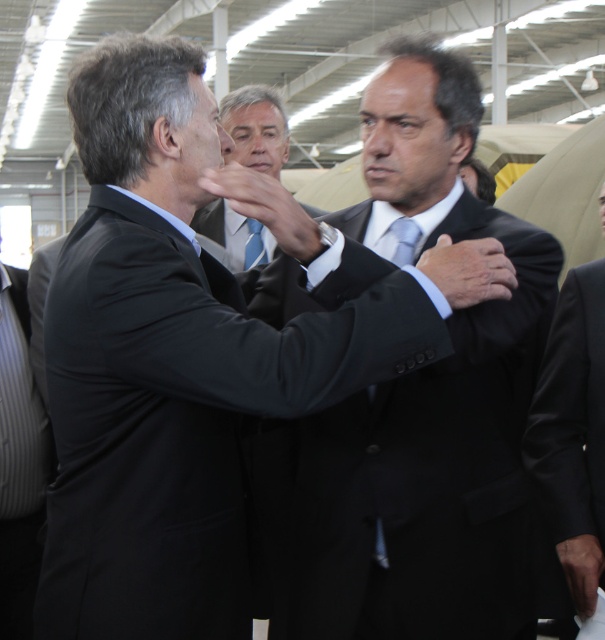
Is point (580, 276) less distant than point (280, 164)?

Yes, point (580, 276) is closer to viewer.

Image resolution: width=605 pixels, height=640 pixels. In order to click on black satin suit at right in this screenshot , I will do `click(572, 433)`.

Who is more forward, (586, 458) or (234, 92)?

Point (586, 458)

Identify the location of black satin suit at right. The image size is (605, 640). (572, 433).

Between gray striped suit at left and matte black suit at center, which one appears on the right side from the viewer's perspective?

matte black suit at center

The width and height of the screenshot is (605, 640). What are the coordinates of `gray striped suit at left` in the screenshot? It's located at pyautogui.click(x=18, y=460).

Measure the distance between gray striped suit at left and camera.

gray striped suit at left is 7.29 feet from camera.

At what (x,y) coordinates should I click in order to perform the action: click on gray striped suit at left. Please return your answer as a coordinate pair (x, y). Looking at the image, I should click on (18, 460).

From the picture: Does black satin suit at center have a lesser height compared to blue striped tie at center?

No.

Does black satin suit at center lie in front of blue striped tie at center?

That is True.

Is point (345, 484) closer to viewer compared to point (260, 257)?

That is True.

Find the location of a particular element. The width and height of the screenshot is (605, 640). black satin suit at center is located at coordinates (430, 472).